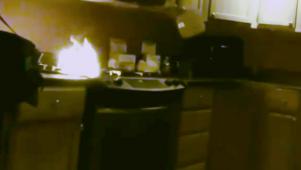
The width and height of the screenshot is (301, 170). Find the location of `drawers`. drawers is located at coordinates (67, 113), (193, 101), (196, 118), (195, 148).